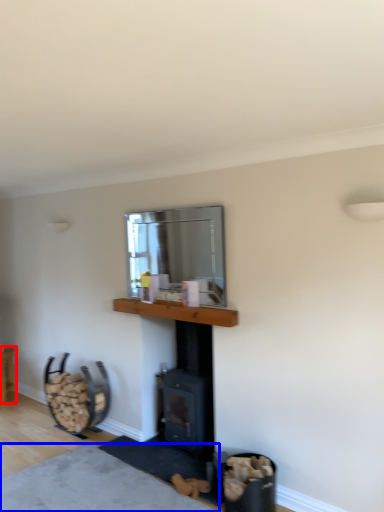
Question: Which object is further to the camera taking this photo, furniture (highlighted by a red box) or plain (highlighted by a blue box)?

Choices:
 (A) furniture
 (B) plain

Answer: (A)